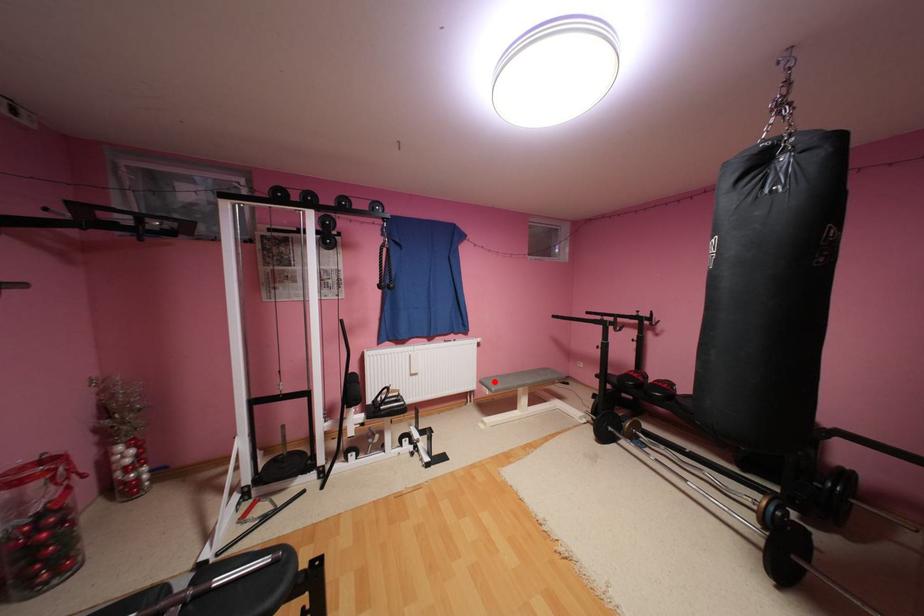
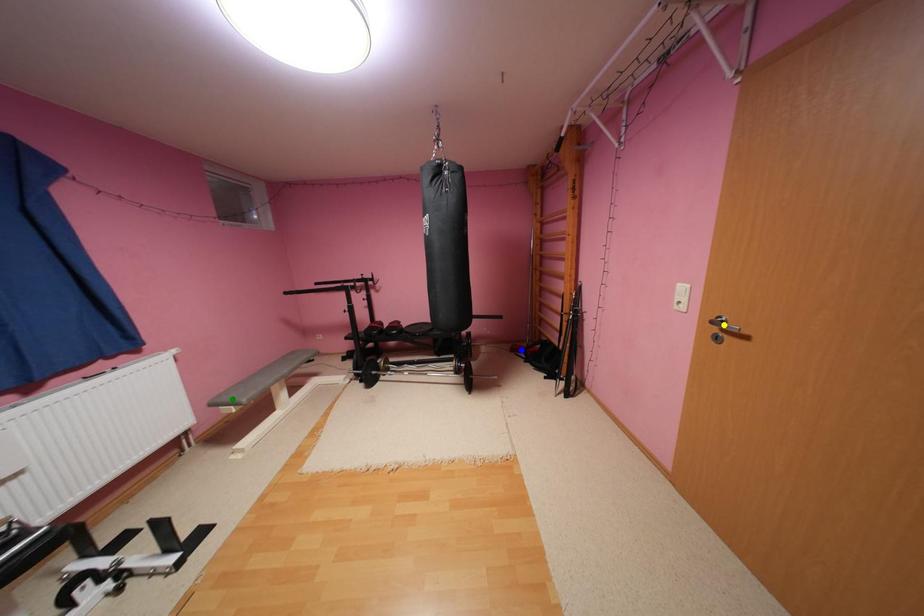
Question: I am providing you with two images of the same scene from different viewpoints. A red point is marked on the first image. You are given multiple points on the second image. Which point in image 2 represents the same 3d spot as the red point in image 1?

Choices:
 (A) blue point
 (B) yellow point
 (C) green point

Answer: (C)